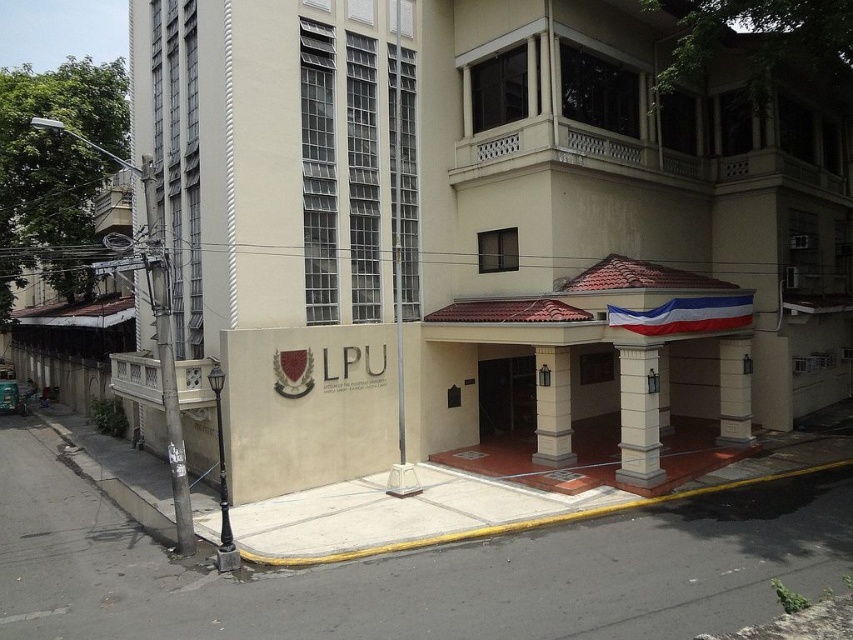
You are standing at the entrance of Lopez University and want to take a photo of the beige concrete building at center. If you move 0.2 units to the right along the x axis and 0.1 units up along the y axis, will you be closer to the building?

The beige concrete building at center is located at point (606,234). Moving 0.2 units right on the x axis and 0.1 units up on the y axis would place you at (692,362). Since the building is at (606,234), you are moving away from the building in both x and y directions, so you will be farther away from the building.

You are a delivery person who needs to park your van on the sidewalk in front of the beige concrete building at center. The van is 2.5 meters wide. The white fabric flag at center is hanging from a column near the entrance. Can you park your van without blocking the flag?

The beige concrete building at center might be wider than white fabric flag at center. Since the flag is hanging from a column near the entrance, there might be enough space on the sidewalk to park the van without blocking it. However, the exact width comparison isn not certain, so proceed with caution.

You are standing on the sidewalk in front of the Lopez University building. You see the beige concrete building at center and the white fabric flag at center. Which object is positioned to the left of the other?

The beige concrete building at center is to the left of the white fabric flag at center according to the description.